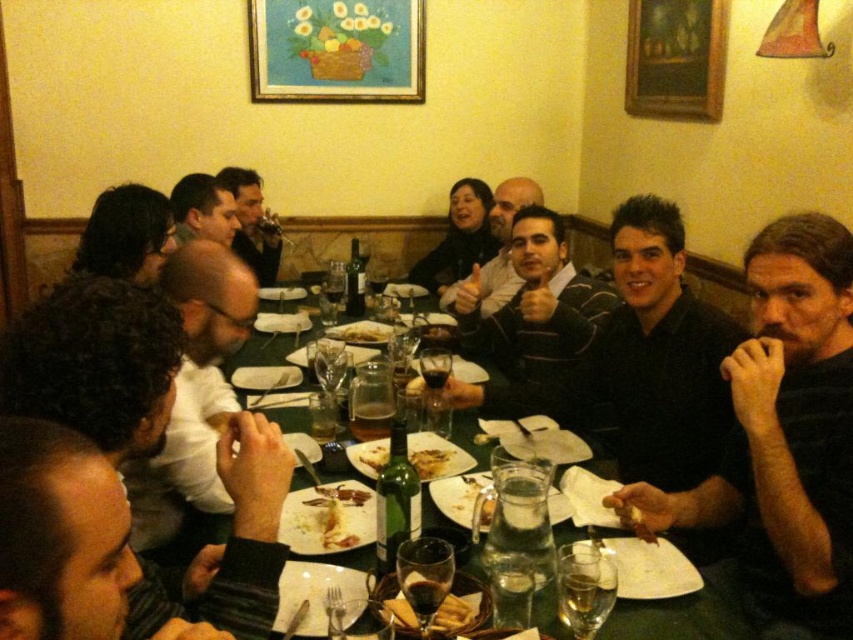
Question: Which object is closer to the camera taking this photo?

Choices:
 (A) smooth black shirt at center
 (B) matte white shirt at left

Answer: (B)

Question: Does matte black shirt at upper center have a greater width compared to golden crispy bread at center?

Choices:
 (A) yes
 (B) no

Answer: (B)

Question: Which object is farther from the camera taking this photo?

Choices:
 (A) wooden picture frame at upper center
 (B) matte white shirt at left
 (C) white creamy pasta at center
 (D) wooden frame at upper center

Answer: (D)

Question: Can you confirm if wooden frame at upper center is smaller than smooth black shirt at center?

Choices:
 (A) no
 (B) yes

Answer: (A)

Question: Estimate the real-world distances between objects in this image. Which object is closer to the wooden frame at upper center?

Choices:
 (A) crusty bread at table center
 (B) golden crispy bread at center
 (C) matte black shirt at center
 (D) white creamy pasta at center

Answer: (C)

Question: Is black matte shirt at upper right bigger than dark curly hair at left?

Choices:
 (A) yes
 (B) no

Answer: (A)